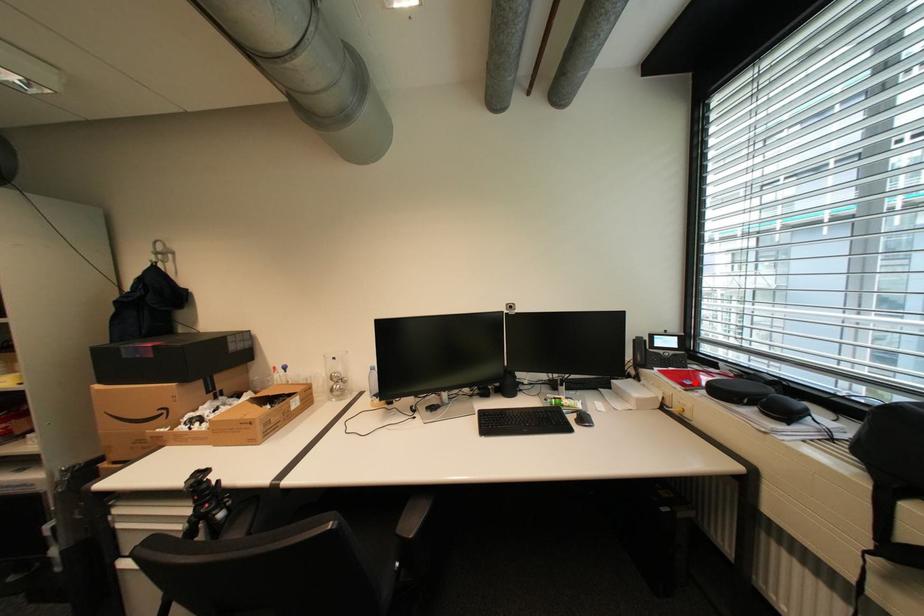
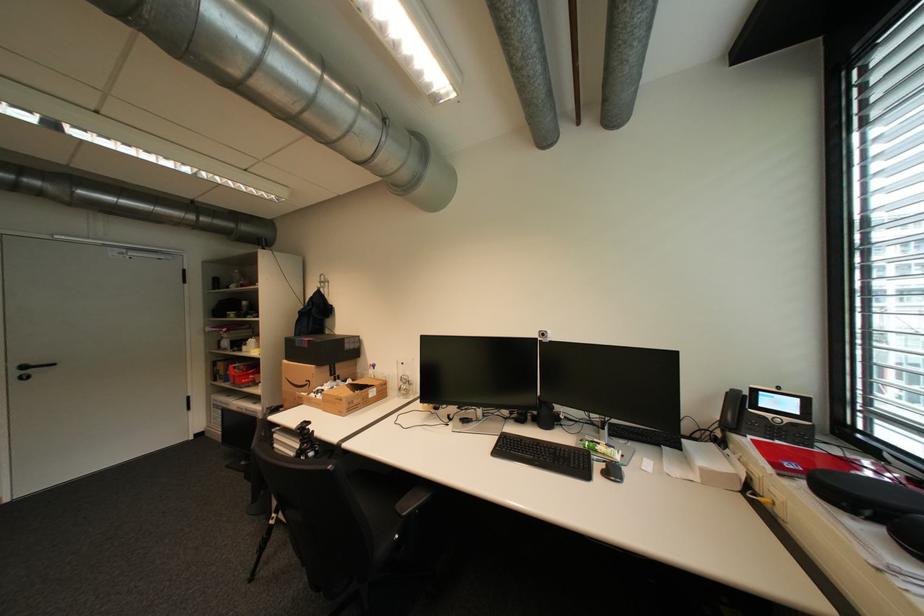
Find the pixel in the second image that matches the highlighted location in the first image.

(796, 466)